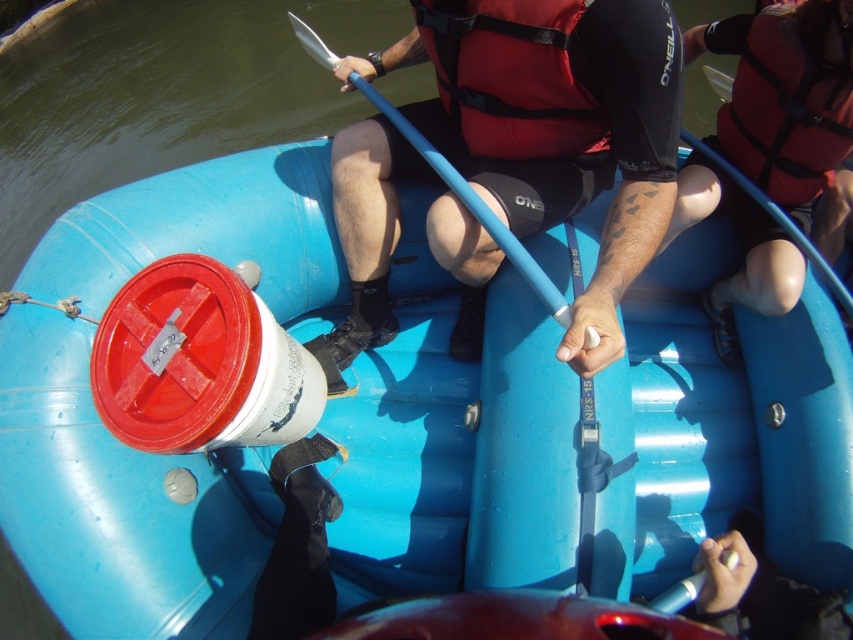
Question: Can you confirm if matte blue paddle at center is positioned above red nylon life jacket at upper right?

Choices:
 (A) no
 (B) yes

Answer: (A)

Question: Does red nylon life jacket at center come in front of red nylon life jacket at upper right?

Choices:
 (A) yes
 (B) no

Answer: (A)

Question: Can you confirm if red life vest at upper right is positioned below red nylon life jacket at upper right?

Choices:
 (A) no
 (B) yes

Answer: (B)

Question: Which point appears farthest from the camera in this image?

Choices:
 (A) (793, 156)
 (B) (646, 44)

Answer: (A)

Question: Based on their relative distances, which object is farther from the red life vest at upper right?

Choices:
 (A) red nylon life jacket at center
 (B) red nylon life jacket at upper right
 (C) matte blue paddle at center

Answer: (A)

Question: Which point appears farthest from the camera in this image?

Choices:
 (A) (769, 156)
 (B) (486, 115)

Answer: (A)